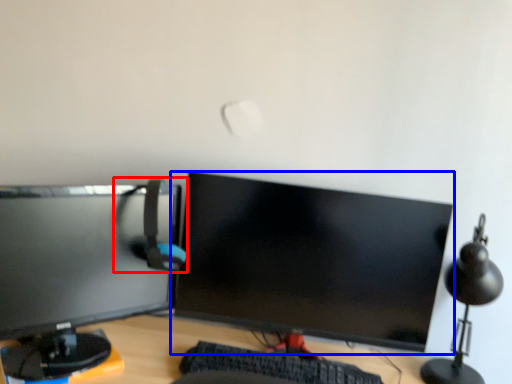
Question: Which object appears farthest to the camera in this image, computer chair (highlighted by a red box) or computer monitor (highlighted by a blue box)?

Choices:
 (A) computer chair
 (B) computer monitor

Answer: (B)